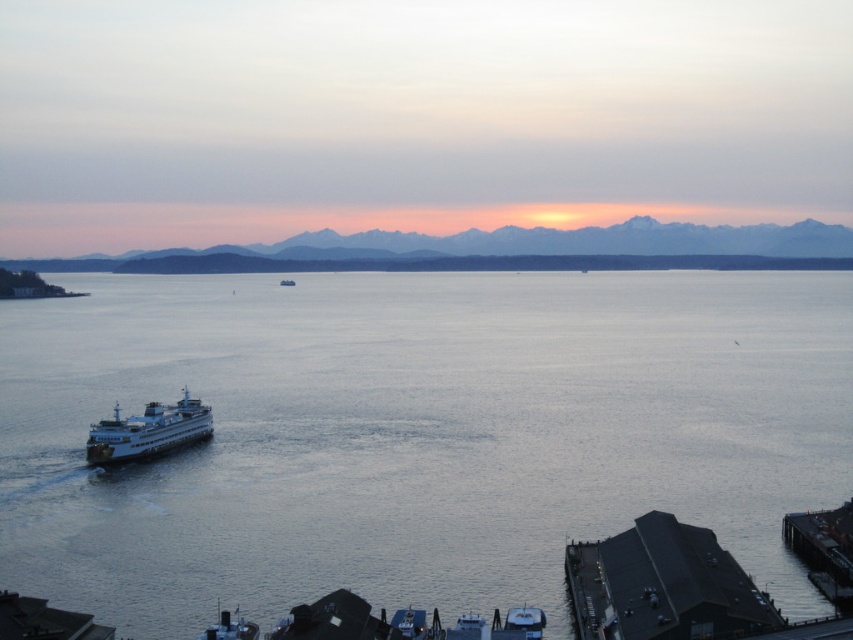
You are standing on a pier and see the gray water at center and the white glossy ferry at lower left. Which object is nearer to you?

The gray water at center is closer to the viewer than the white glossy ferry at lower left.

You are a photographer trying to capture the ferry boat in the foreground and the gray water at center in the background. Based on their positions, which object is closer to the camera?

The ferry boat is closer to the camera than the gray water at center because it is positioned in the foreground of the image.